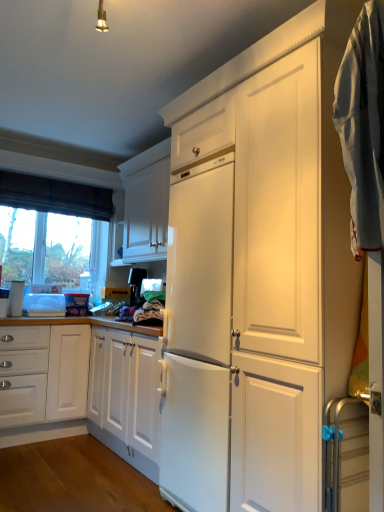
Where is `transparent glass window at left`? transparent glass window at left is located at coordinates (55, 196).

You are a GUI agent. You are given a task and a screenshot of the screen. Output one action in this format:
    pyautogui.click(x=<x>, y=<y>)
    Task: Click on the transparent glass window at left
    
    Given the screenshot: What is the action you would take?
    pyautogui.click(x=55, y=196)

Is light blue cotton towel at right facing away from white glossy cabinet at upper center?

No, light blue cotton towel at right is not facing away from white glossy cabinet at upper center.

Is point (366, 85) farther from camera compared to point (122, 221)?

No, it is not.

Considering the sizes of objects light blue cotton towel at right and white glossy cabinet at upper center in the image provided, who is shorter, light blue cotton towel at right or white glossy cabinet at upper center?

With less height is white glossy cabinet at upper center.

From a real-world perspective, who is located lower, metallic silver towel rack at right, the 2th appliance positioned from the top, or satin black coffee maker at center, which ranks as the second appliance in right-to-left order?

metallic silver towel rack at right, the 2th appliance positioned from the top, is physically lower.

Is metallic silver towel rack at right, positioned as the 2th appliance in left-to-right order, turned away from satin black coffee maker at center, which ranks as the second appliance in right-to-left order?

That's not correct — metallic silver towel rack at right, positioned as the 2th appliance in left-to-right order, is not looking away from satin black coffee maker at center, which ranks as the second appliance in right-to-left order.

Which object is positioned more to the right, metallic silver towel rack at right, the second appliance when ordered from back to front, or satin black coffee maker at center, which appears as the 1th appliance when viewed from the top?

metallic silver towel rack at right, the second appliance when ordered from back to front.

In terms of size, does metallic silver towel rack at right, the 2th appliance positioned from the top, appear bigger or smaller than satin black coffee maker at center, placed as the 1th appliance when sorted from left to right?

In the image, metallic silver towel rack at right, the 2th appliance positioned from the top, appears to be smaller than satin black coffee maker at center, placed as the 1th appliance when sorted from left to right.

Between light blue cotton towel at right and transparent glass window at left, which one has more height?

light blue cotton towel at right.

Is light blue cotton towel at right not near transparent glass window at left?

Yes, light blue cotton towel at right and transparent glass window at left are located far from each other.

How much distance is there between light blue cotton towel at right and transparent glass window at left?

light blue cotton towel at right is 3.12 meters from transparent glass window at left.

Is transparent glass window at left at the right side of white glossy cabinet at upper center?

No, transparent glass window at left is not to the right of white glossy cabinet at upper center.

Locate an element on the screen. The width and height of the screenshot is (384, 512). window below the white glossy cabinet at upper center (from the image's perspective) is located at coordinates 55,196.

Is transparent glass window at left placed right next to white glossy cabinet at upper center?

No, transparent glass window at left is not beside white glossy cabinet at upper center.

Is transparent glass window at left positioned with its back to white glossy cabinet at upper center?

transparent glass window at left does not have its back to white glossy cabinet at upper center.

Is satin black coffee maker at center, acting as the second appliance starting from the bottom, placed right next to metallic silver towel rack at right, positioned as the 2th appliance in left-to-right order?

satin black coffee maker at center, acting as the second appliance starting from the bottom, is not next to metallic silver towel rack at right, positioned as the 2th appliance in left-to-right order, and they're not touching.

How different are the orientations of satin black coffee maker at center, acting as the 2th appliance starting from the front, and metallic silver towel rack at right, positioned as the first appliance in bottom-to-top order, in degrees?

The angle between the facing direction of satin black coffee maker at center, acting as the 2th appliance starting from the front, and the facing direction of metallic silver towel rack at right, positioned as the first appliance in bottom-to-top order, is 1.87 degrees.

From a real-world perspective, is satin black coffee maker at center, the first appliance in the back-to-front sequence, positioned under metallic silver towel rack at right, positioned as the first appliance in bottom-to-top order, based on gravity?

No, from a real-world perspective, satin black coffee maker at center, the first appliance in the back-to-front sequence, is not beneath metallic silver towel rack at right, positioned as the first appliance in bottom-to-top order.

Considering the sizes of objects white glossy cabinet at upper center and satin black coffee maker at center, acting as the second appliance starting from the bottom, in the image provided, who is bigger, white glossy cabinet at upper center or satin black coffee maker at center, acting as the second appliance starting from the bottom,?

white glossy cabinet at upper center.

The height and width of the screenshot is (512, 384). I want to click on cabinetry lying in front of the satin black coffee maker at center, acting as the second appliance starting from the bottom, so click(x=145, y=206).

Is the position of white glossy cabinet at upper center less distant than that of satin black coffee maker at center, placed as the 1th appliance when sorted from left to right?

That is True.

Considering the positions of objects metallic silver towel rack at right, positioned as the first appliance in bottom-to-top order, and transparent glass window at left in the image provided, who is in front, metallic silver towel rack at right, positioned as the first appliance in bottom-to-top order, or transparent glass window at left?

metallic silver towel rack at right, positioned as the first appliance in bottom-to-top order.

Considering the sizes of objects metallic silver towel rack at right, positioned as the 2th appliance in left-to-right order, and transparent glass window at left in the image provided, who is smaller, metallic silver towel rack at right, positioned as the 2th appliance in left-to-right order, or transparent glass window at left?

With smaller size is metallic silver towel rack at right, positioned as the 2th appliance in left-to-right order.

Is metallic silver towel rack at right, the 2th appliance positioned from the top, aimed at transparent glass window at left?

No, metallic silver towel rack at right, the 2th appliance positioned from the top, is not facing towards transparent glass window at left.

How much distance is there between metallic silver towel rack at right, positioned as the first appliance in front-to-back order, and transparent glass window at left?

The distance of metallic silver towel rack at right, positioned as the first appliance in front-to-back order, from transparent glass window at left is 3.08 meters.

At what (x,y) coordinates should I click in order to perform the action: click on laundry located in front of the white glossy cabinet at upper center. Please return your answer as a coordinate pair (x, y). The width and height of the screenshot is (384, 512). Looking at the image, I should click on (363, 158).

Where is `appliance on the right of satin black coffee maker at center, which appears as the 1th appliance when viewed from the top`? Image resolution: width=384 pixels, height=512 pixels. appliance on the right of satin black coffee maker at center, which appears as the 1th appliance when viewed from the top is located at coordinates (346, 455).

Estimate the real-world distances between objects in this image. Which object is further from light blue cotton towel at right, metallic silver towel rack at right, positioned as the 2th appliance in left-to-right order, or satin black coffee maker at center, placed as the 1th appliance when sorted from left to right?

Among the two, satin black coffee maker at center, placed as the 1th appliance when sorted from left to right, is located further to light blue cotton towel at right.

From the image, which object appears to be nearer to satin black coffee maker at center, the first appliance in the back-to-front sequence, white glossy cabinet at upper center or light blue cotton towel at right?

white glossy cabinet at upper center lies closer to satin black coffee maker at center, the first appliance in the back-to-front sequence, than the other object.

Consider the image. Which object lies further to the anchor point satin black coffee maker at center, the first appliance in the back-to-front sequence, metallic silver towel rack at right, the 2th appliance positioned from the top, or light blue cotton towel at right?

light blue cotton towel at right is positioned further to the anchor satin black coffee maker at center, the first appliance in the back-to-front sequence.

Estimate the real-world distances between objects in this image. Which object is further from light blue cotton towel at right, white glossy cabinet at upper center or metallic silver towel rack at right, positioned as the first appliance in front-to-back order?

white glossy cabinet at upper center lies further to light blue cotton towel at right than the other object.

Looking at the image, which one is located closer to transparent glass window at left, light blue cotton towel at right or metallic silver towel rack at right, marked as the 1th appliance in a right-to-left arrangement?

metallic silver towel rack at right, marked as the 1th appliance in a right-to-left arrangement, is positioned closer to the anchor transparent glass window at left.

When comparing their distances from white glossy cabinet at upper center, does light blue cotton towel at right or transparent glass window at left seem further?

light blue cotton towel at right.

Estimate the real-world distances between objects in this image. Which object is further from satin black coffee maker at center, which ranks as the second appliance in right-to-left order, transparent glass window at left or white glossy cabinet at upper center?

transparent glass window at left.

Which object lies nearer to the anchor point white glossy cabinet at upper center, transparent glass window at left or satin black coffee maker at center, which appears as the 1th appliance when viewed from the top?

The object closer to white glossy cabinet at upper center is satin black coffee maker at center, which appears as the 1th appliance when viewed from the top.

Image resolution: width=384 pixels, height=512 pixels. In order to click on cabinetry located between transparent glass window at left and satin black coffee maker at center, placed as the 1th appliance when sorted from left to right, in the left-right direction in this screenshot , I will do `click(145, 206)`.

You are a GUI agent. You are given a task and a screenshot of the screen. Output one action in this format:
    pyautogui.click(x=<x>, y=<y>)
    Task: Click on the cabinetry positioned between metallic silver towel rack at right, the 2th appliance positioned from the top, and transparent glass window at left from near to far
    
    Given the screenshot: What is the action you would take?
    pyautogui.click(x=145, y=206)

What are the coordinates of `appliance between light blue cotton towel at right and white glossy cabinet at upper center in the front-back direction` in the screenshot? It's located at (346, 455).

Locate an element on the screen. The height and width of the screenshot is (512, 384). cabinetry positioned between light blue cotton towel at right and satin black coffee maker at center, acting as the 2th appliance starting from the front, from near to far is located at coordinates (145, 206).